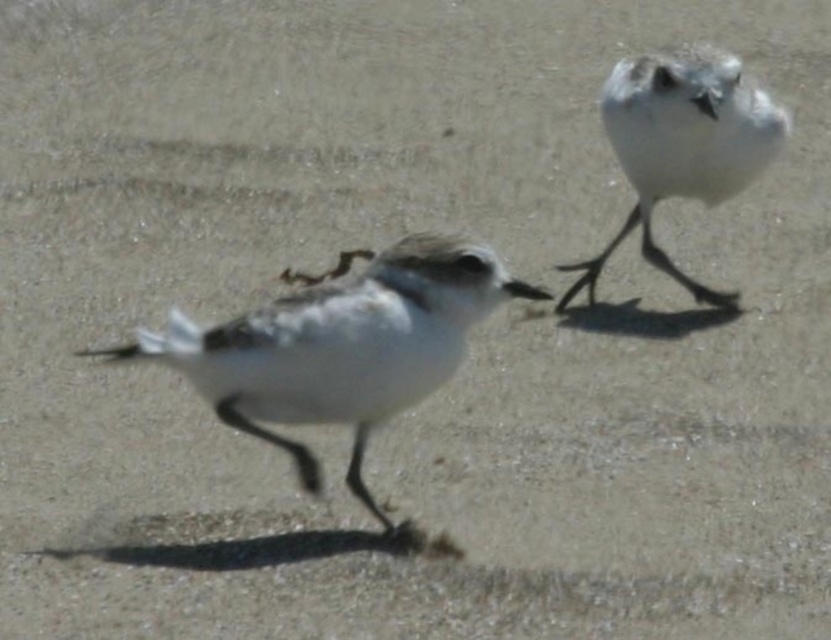
Can you confirm if white matte bird at center is thinner than white matte bird at upper right?

In fact, white matte bird at center might be wider than white matte bird at upper right.

Looking at this image, which of these two, white matte bird at center or white matte bird at upper right, stands taller?

With more height is white matte bird at upper right.

Between point (306, 364) and point (718, 147), which one is positioned in front?

Point (306, 364) is more forward.

Image resolution: width=831 pixels, height=640 pixels. In order to click on white matte bird at center in this screenshot , I will do `click(340, 346)`.